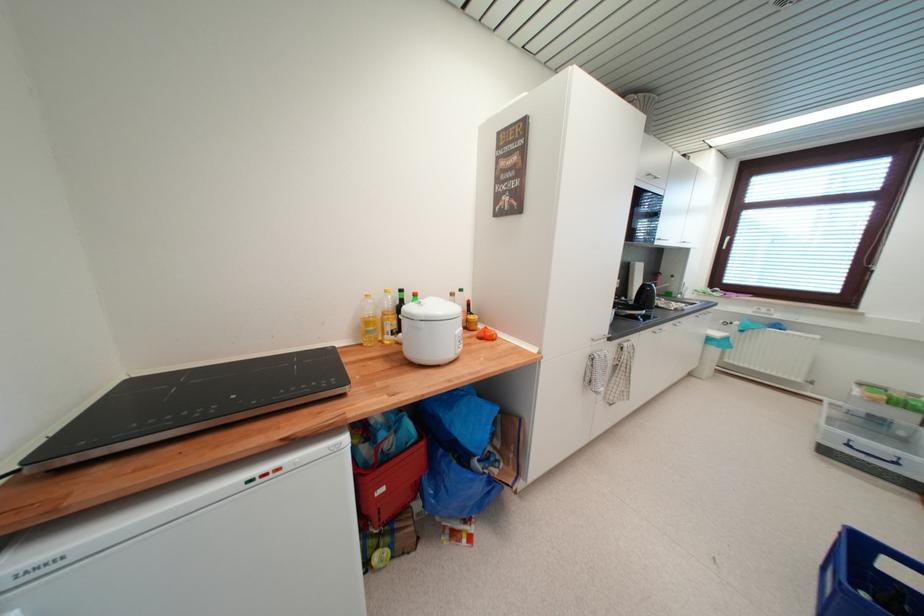
Image resolution: width=924 pixels, height=616 pixels. I want to click on red storage box, so click(x=386, y=475).